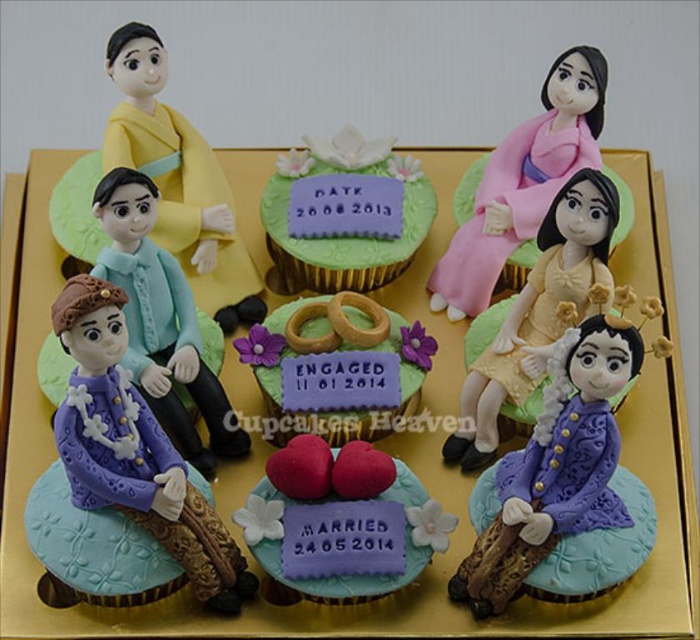
Question: Which of the following is the farthest from the observer?

Choices:
 (A) matte purple fondant cake at center
 (B) purple glossy figurine at center

Answer: (A)

Question: Is purple matte figure at center-left thinner than gold textured rings at center?

Choices:
 (A) no
 (B) yes

Answer: (B)

Question: Is purple matte figure at center-left to the right of matte purple cupcake with hearts at center from the viewer's perspective?

Choices:
 (A) no
 (B) yes

Answer: (A)

Question: Among these objects, which one is farthest from the camera?

Choices:
 (A) pink matte kimono at upper center
 (B) purple matte figure at center-left
 (C) matte purple cupcake with hearts at center
 (D) matte purple fondant cake at center

Answer: (D)

Question: Considering the real-world distances, which object is closest to the gold textured rings at center?

Choices:
 (A) yellow matte dress at center
 (B) yellow matte/glossy doll at upper left
 (C) matte purple cupcake with hearts at center
 (D) purple glossy figurine at center

Answer: (C)

Question: Can you confirm if matte purple cupcake with hearts at center is smaller than matte purple fondant cake at center?

Choices:
 (A) no
 (B) yes

Answer: (B)